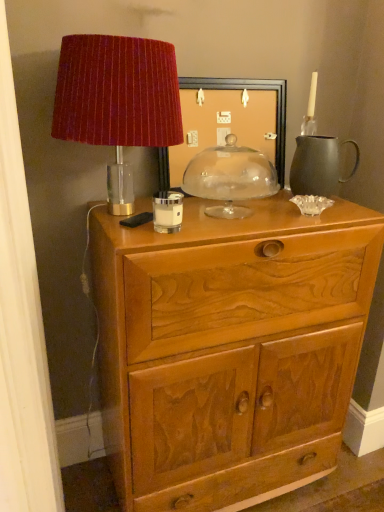
In order to click on vacant point to the left of white glass candle holder at center, which appears as the first candle holder when viewed from the front in this screenshot , I will do `click(131, 222)`.